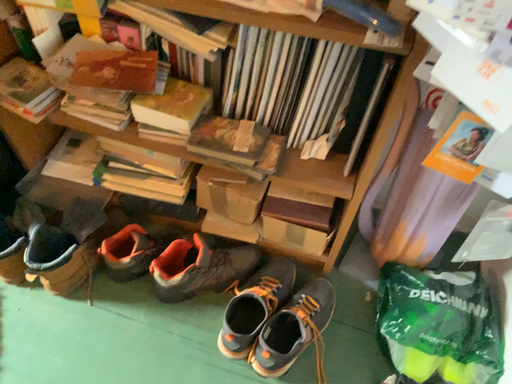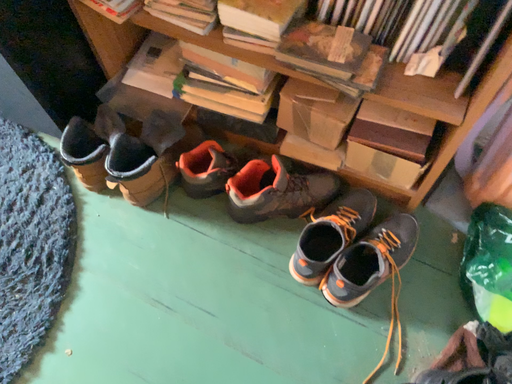
Question: Which way did the camera rotate in the video?

Choices:
 (A) rotated left
 (B) rotated right

Answer: (A)